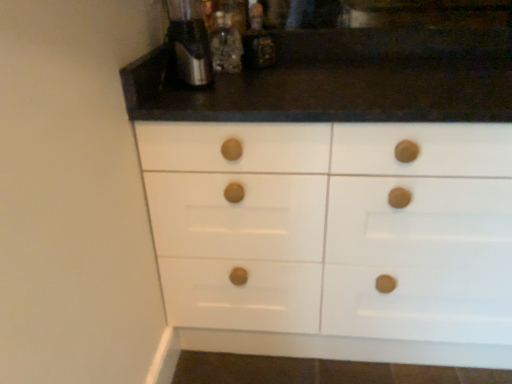
Question: From the image's perspective, is satin silver coffee machine at upper center over metallic silver bottle at upper center, acting as the second bottle starting from the left?

Choices:
 (A) yes
 (B) no

Answer: (B)

Question: Is metallic silver bottle at upper center, the first bottle when ordered from right to left, at the back of satin silver coffee machine at upper center?

Choices:
 (A) no
 (B) yes

Answer: (A)

Question: Does satin silver coffee machine at upper center appear on the right side of metallic silver bottle at upper center, acting as the second bottle starting from the left?

Choices:
 (A) yes
 (B) no

Answer: (B)

Question: Considering the relative positions of satin silver coffee machine at upper center and metallic silver bottle at upper center, acting as the second bottle starting from the left, in the image provided, is satin silver coffee machine at upper center behind metallic silver bottle at upper center, acting as the second bottle starting from the left,?

Choices:
 (A) no
 (B) yes

Answer: (A)

Question: Is satin silver coffee machine at upper center in contact with metallic silver bottle at upper center, the first bottle when ordered from right to left?

Choices:
 (A) yes
 (B) no

Answer: (B)

Question: In terms of size, does satin silver coffee machine at upper center appear bigger or smaller than metallic silver bottle at upper center, acting as the second bottle starting from the left?

Choices:
 (A) small
 (B) big

Answer: (B)

Question: Considering the positions of point (172, 14) and point (271, 46), is point (172, 14) closer or farther from the camera than point (271, 46)?

Choices:
 (A) closer
 (B) farther

Answer: (B)

Question: Would you say satin silver coffee machine at upper center is to the left or to the right of metallic silver bottle at upper center, the first bottle when ordered from right to left, in the picture?

Choices:
 (A) left
 (B) right

Answer: (A)

Question: From the image's perspective, is satin silver coffee machine at upper center located above or below metallic silver bottle at upper center, the first bottle when ordered from right to left?

Choices:
 (A) below
 (B) above

Answer: (A)

Question: From the image's perspective, relative to translucent glass bottle at upper center, which is the second bottle from right to left, is satin silver coffee machine at upper center above or below?

Choices:
 (A) below
 (B) above

Answer: (A)

Question: Considering the positions of point (200, 59) and point (233, 72), is point (200, 59) closer or farther from the camera than point (233, 72)?

Choices:
 (A) farther
 (B) closer

Answer: (B)

Question: In the image, is satin silver coffee machine at upper center on the left side or the right side of translucent glass bottle at upper center, the first bottle when ordered from left to right?

Choices:
 (A) left
 (B) right

Answer: (A)

Question: Is satin silver coffee machine at upper center bigger or smaller than translucent glass bottle at upper center, which is the second bottle from right to left?

Choices:
 (A) big
 (B) small

Answer: (A)

Question: In the image, is translucent glass bottle at upper center, the first bottle when ordered from left to right, positioned in front of or behind satin silver coffee machine at upper center?

Choices:
 (A) front
 (B) behind

Answer: (B)

Question: From the image's perspective, is translucent glass bottle at upper center, which is the second bottle from right to left, located above or below satin silver coffee machine at upper center?

Choices:
 (A) above
 (B) below

Answer: (A)